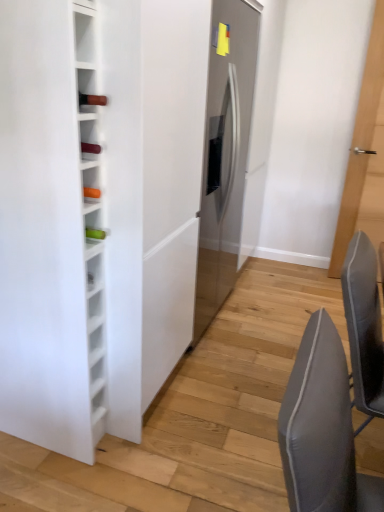
Question: Is white glass wine rack at left facing away from gray fabric chair at lower right?

Choices:
 (A) no
 (B) yes

Answer: (A)

Question: Does white glass wine rack at left have a lesser width compared to gray fabric chair at lower right?

Choices:
 (A) yes
 (B) no

Answer: (B)

Question: Does white glass wine rack at left have a lesser height compared to gray fabric chair at lower right?

Choices:
 (A) yes
 (B) no

Answer: (B)

Question: Does white glass wine rack at left appear on the right side of gray fabric chair at lower right?

Choices:
 (A) yes
 (B) no

Answer: (B)

Question: From the image's perspective, does white glass wine rack at left appear higher than gray fabric chair at lower right?

Choices:
 (A) yes
 (B) no

Answer: (A)

Question: Choose the correct answer: Is light brown wooden door at right inside white glass wine rack at left or outside it?

Choices:
 (A) outside
 (B) inside

Answer: (A)

Question: Relative to white glass wine rack at left, is light brown wooden door at right in front or behind?

Choices:
 (A) front
 (B) behind

Answer: (B)

Question: Considering the positions of light brown wooden door at right and white glass wine rack at left in the image, is light brown wooden door at right bigger or smaller than white glass wine rack at left?

Choices:
 (A) big
 (B) small

Answer: (B)

Question: Is point (349, 181) closer or farther from the camera than point (54, 320)?

Choices:
 (A) farther
 (B) closer

Answer: (A)

Question: From the image's perspective, is light brown wooden door at right located above or below satin silver refrigerator at center?

Choices:
 (A) below
 (B) above

Answer: (B)

Question: Considering the positions of point (354, 222) and point (203, 257), is point (354, 222) closer or farther from the camera than point (203, 257)?

Choices:
 (A) farther
 (B) closer

Answer: (A)

Question: From a real-world perspective, is light brown wooden door at right positioned above or below satin silver refrigerator at center?

Choices:
 (A) below
 (B) above

Answer: (B)

Question: Which is correct: light brown wooden door at right is inside satin silver refrigerator at center, or outside of it?

Choices:
 (A) inside
 (B) outside

Answer: (B)

Question: In the image, is light brown wooden door at right positioned in front of or behind gray fabric chair at lower right?

Choices:
 (A) behind
 (B) front

Answer: (A)

Question: Considering the positions of point (352, 219) and point (304, 401), is point (352, 219) closer or farther from the camera than point (304, 401)?

Choices:
 (A) closer
 (B) farther

Answer: (B)